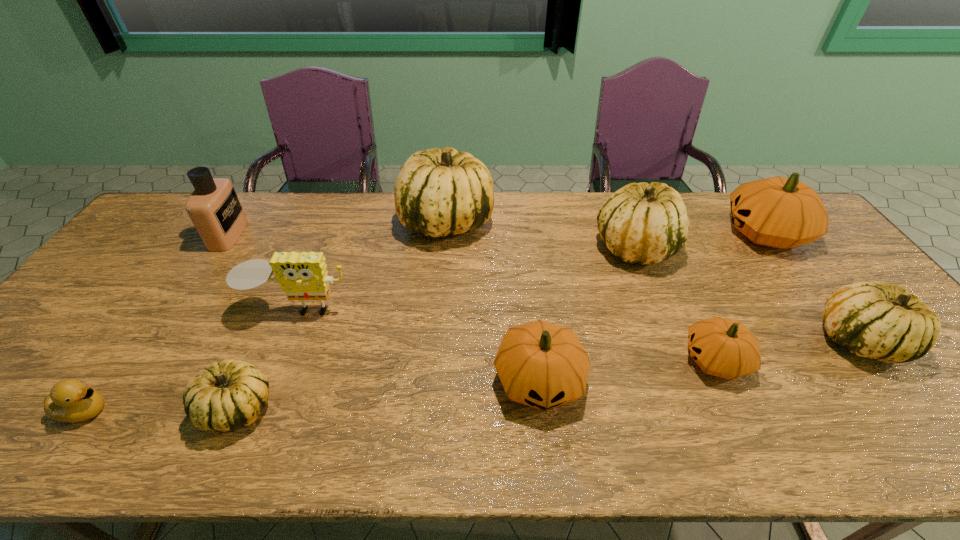
At what (x,y) coordinates should I click in order to perform the action: click on object that is positioned at the near left corner. Please return your answer as a coordinate pair (x, y). Image resolution: width=960 pixels, height=540 pixels. Looking at the image, I should click on (71, 401).

Find the location of a particular element. object located in the far right corner section of the desktop is located at coordinates (778, 212).

The width and height of the screenshot is (960, 540). In the image, there is a desktop. Find the location of `free space at the far edge`. free space at the far edge is located at coordinates (559, 213).

Image resolution: width=960 pixels, height=540 pixels. Find the location of `free region at the near edge of the desktop`. free region at the near edge of the desktop is located at coordinates 173,443.

In the image, there is a desktop. Where is `vacant space at the left edge`? vacant space at the left edge is located at coordinates (145, 252).

This screenshot has height=540, width=960. I want to click on free spot between the nearest white gourd and the perfume, so click(233, 321).

Identify the location of vacant region between the perfume and the biggest orange gourd. (496, 234).

Where is `free space between the beige perfume and the leftmost white gourd`? The width and height of the screenshot is (960, 540). free space between the beige perfume and the leftmost white gourd is located at coordinates (233, 321).

In order to click on vacant area that lies between the yellow sponge and the biggest white gourd in this screenshot , I will do `click(372, 265)`.

Find the location of `vacant space that's between the second smallest white gourd and the smallest orange gourd`. vacant space that's between the second smallest white gourd and the smallest orange gourd is located at coordinates (787, 350).